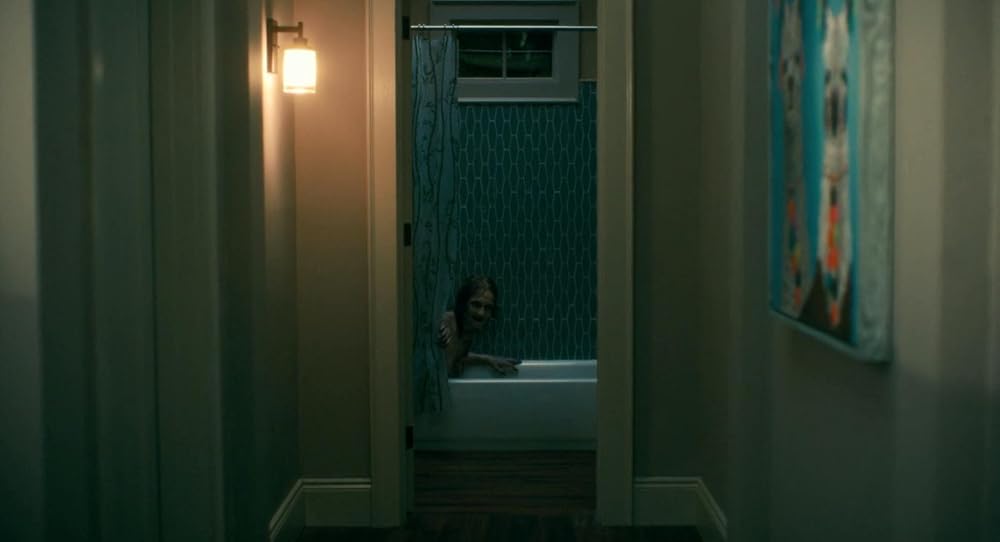
The height and width of the screenshot is (542, 1000). I want to click on tan wall, so click(334, 195).